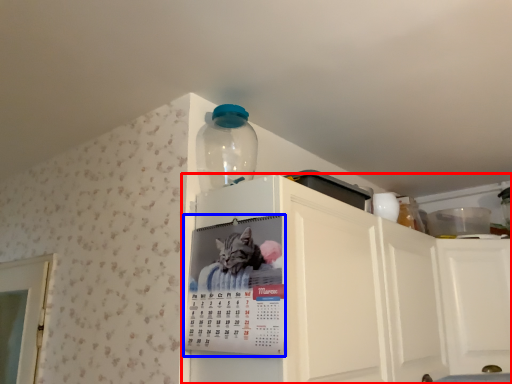
Question: Which object appears farthest to the camera in this image, cabinetry (highlighted by a red box) or poster (highlighted by a blue box)?

Choices:
 (A) cabinetry
 (B) poster

Answer: (B)